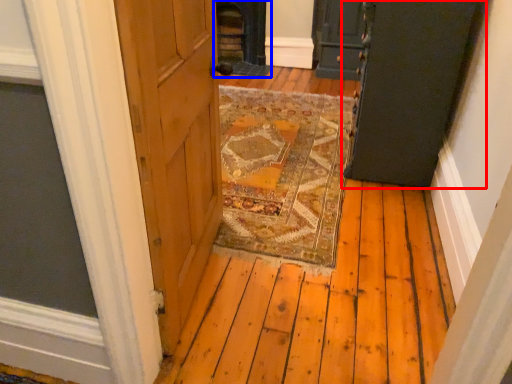
Question: Which point is further to the camera, door (highlighted by a red box) or fireplace (highlighted by a blue box)?

Choices:
 (A) door
 (B) fireplace

Answer: (B)